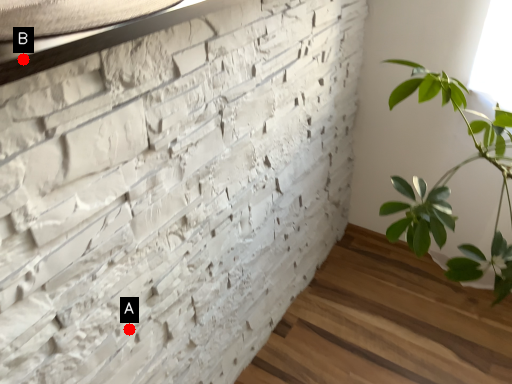
Question: Two points are circled on the image, labeled by A and B beside each circle. Among these points, which one is nearest to the camera?

Choices:
 (A) A is closer
 (B) B is closer

Answer: (B)